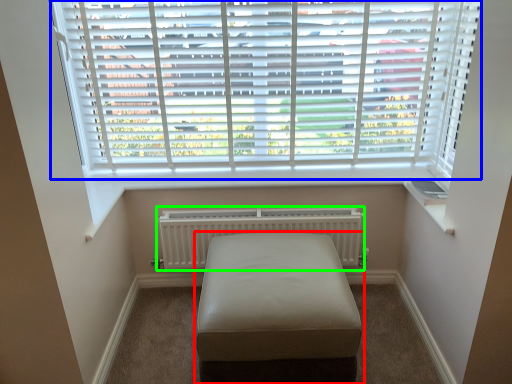
Question: Which is farther away from furniture (highlighted by a red box)? window blind (highlighted by a blue box) or radiator (highlighted by a green box)?

Choices:
 (A) window blind
 (B) radiator

Answer: (A)